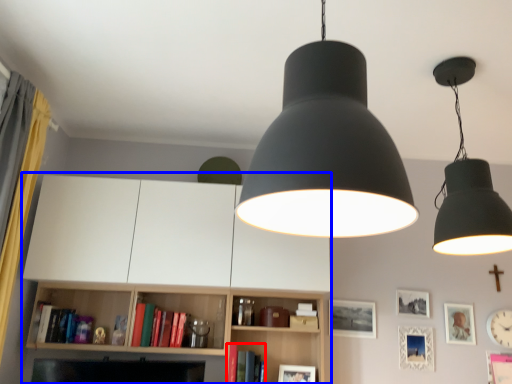
Question: Among these objects, which one is farthest to the camera, book (highlighted by a red box) or entertainment center (highlighted by a blue box)?

Choices:
 (A) book
 (B) entertainment center

Answer: (A)